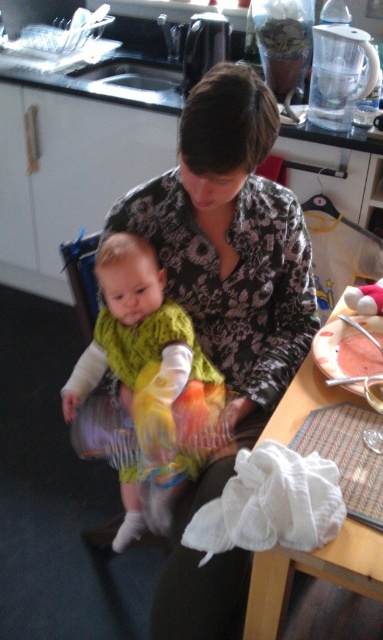
Question: Does black floral shirt at center appear on the left side of white cloth at lower right?

Choices:
 (A) no
 (B) yes

Answer: (B)

Question: Can you confirm if black floral shirt at center is smaller than white cloth at lower right?

Choices:
 (A) yes
 (B) no

Answer: (B)

Question: Among these points, which one is farthest from the camera?

Choices:
 (A) (191, 90)
 (B) (284, 429)
 (C) (134, 369)
 (D) (363, 353)

Answer: (A)

Question: Which of the following is the farthest from the observer?

Choices:
 (A) black floral shirt at center
 (B) multicolored fabric dress at center
 (C) pink matte cake at right
 (D) white cloth at lower right

Answer: (C)

Question: Estimate the real-world distances between objects in this image. Which object is closer to the black floral shirt at center?

Choices:
 (A) white cloth at lower right
 (B) multicolored fabric dress at center

Answer: (B)

Question: Can you confirm if multicolored fabric dress at center is positioned to the right of pink matte cake at right?

Choices:
 (A) yes
 (B) no

Answer: (B)